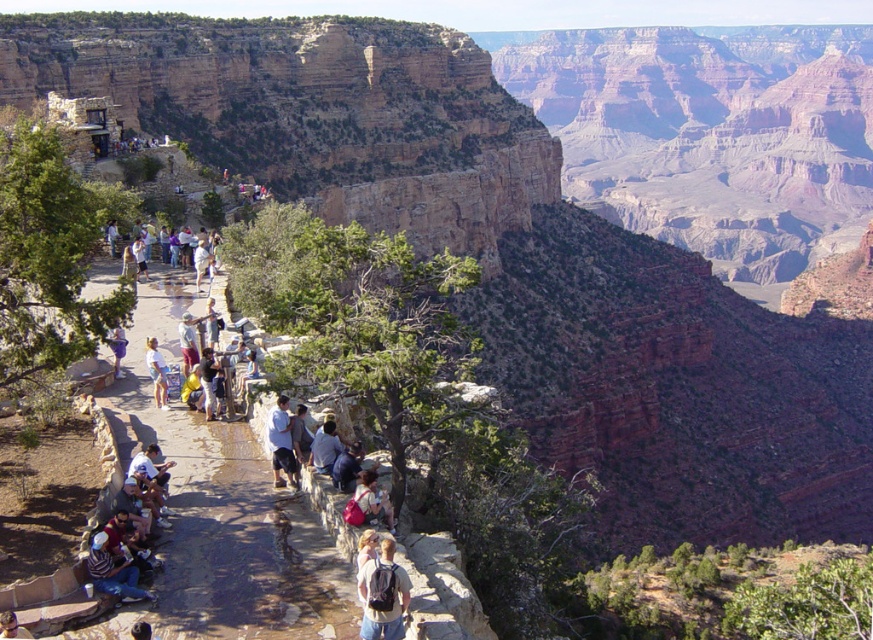
Can you confirm if matte gray backpack at center is taller than light blue shirt at center?

Incorrect, matte gray backpack at center's height is not larger of light blue shirt at center's.

Is matte gray backpack at center to the left of light blue shirt at center from the viewer's perspective?

In fact, matte gray backpack at center is to the right of light blue shirt at center.

This screenshot has height=640, width=873. Find the location of `matte gray backpack at center`. matte gray backpack at center is located at coordinates (388, 593).

Based on the photo, which is more to the right, light blue denim shorts at center or light blue denim shorts at lower left?

light blue denim shorts at center

Does light blue denim shorts at center have a smaller size compared to light blue denim shorts at lower left?

Indeed, light blue denim shorts at center has a smaller size compared to light blue denim shorts at lower left.

Is point (149, 360) positioned in front of point (119, 342)?

Yes, it is in front of point (119, 342).

Locate an element on the screen. The width and height of the screenshot is (873, 640). light blue denim shorts at center is located at coordinates (156, 372).

Can you confirm if matte gray backpack at center is positioned to the right of light blue denim shorts at center?

Correct, you'll find matte gray backpack at center to the right of light blue denim shorts at center.

Between matte gray backpack at center and light blue denim shorts at center, which one appears on the right side from the viewer's perspective?

Positioned to the right is matte gray backpack at center.

Between point (390, 611) and point (162, 360), which one is positioned behind?

Point (162, 360)

Locate an element on the screen. Image resolution: width=873 pixels, height=640 pixels. matte gray backpack at center is located at coordinates (388, 593).